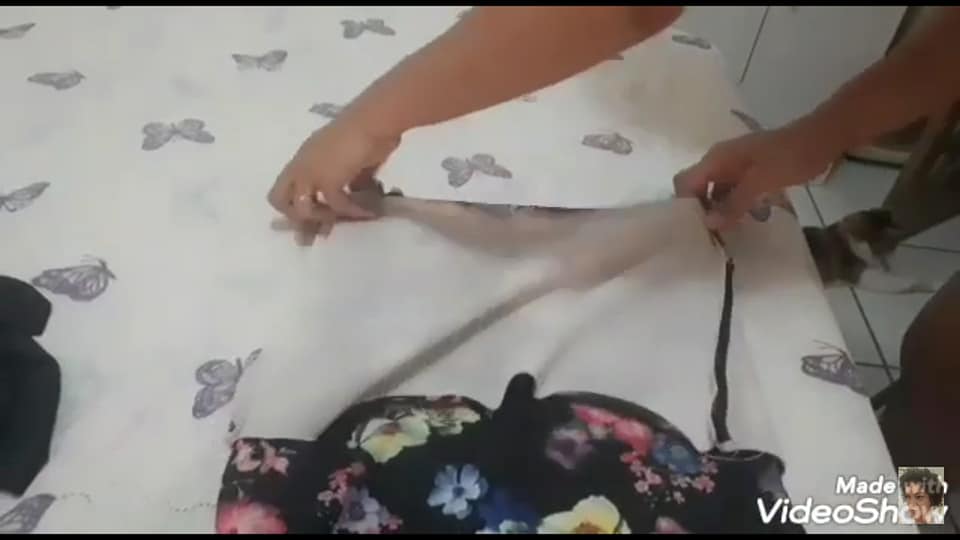
The height and width of the screenshot is (540, 960). I want to click on white fur, so click(x=857, y=245), click(x=879, y=283).